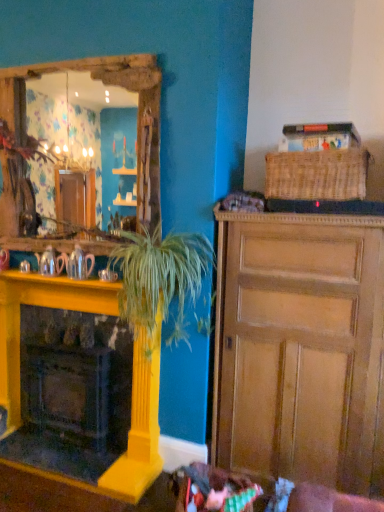
Question: Is wooden cabinet at right aimed at shiny silver teapot at left, the 2th teapot from the right?

Choices:
 (A) no
 (B) yes

Answer: (A)

Question: Is wooden cabinet at right at the right side of shiny silver teapot at left, the 2th teapot from the right?

Choices:
 (A) yes
 (B) no

Answer: (A)

Question: Can you confirm if wooden cabinet at right is wider than shiny silver teapot at left, the first teapot viewed from the left?

Choices:
 (A) no
 (B) yes

Answer: (B)

Question: Is wooden cabinet at right positioned in front of shiny silver teapot at left, the 2th teapot from the right?

Choices:
 (A) yes
 (B) no

Answer: (A)

Question: Is wooden cabinet at right outside of shiny silver teapot at left, the first teapot viewed from the left?

Choices:
 (A) yes
 (B) no

Answer: (A)

Question: Is green leafy plant at center taller or shorter than shiny silver teapot at left, the 2th teapot from the right?

Choices:
 (A) short
 (B) tall

Answer: (B)

Question: Looking at their shapes, would you say green leafy plant at center is wider or thinner than shiny silver teapot at left, the 2th teapot from the right?

Choices:
 (A) wide
 (B) thin

Answer: (A)

Question: Does point (172, 263) appear closer or farther from the camera than point (44, 266)?

Choices:
 (A) closer
 (B) farther

Answer: (A)

Question: Relative to shiny silver teapot at left, the 2th teapot from the right, is green leafy plant at center in front or behind?

Choices:
 (A) front
 (B) behind

Answer: (A)

Question: Is point (142, 433) positioned closer to the camera than point (334, 343)?

Choices:
 (A) farther
 (B) closer

Answer: (A)

Question: Is yellow painted wood fireplace at left in front of or behind wooden cabinet at right in the image?

Choices:
 (A) behind
 (B) front

Answer: (A)

Question: Considering the positions of yellow painted wood fireplace at left and wooden cabinet at right in the image, is yellow painted wood fireplace at left wider or thinner than wooden cabinet at right?

Choices:
 (A) thin
 (B) wide

Answer: (A)

Question: From a real-world perspective, is yellow painted wood fireplace at left positioned above or below wooden cabinet at right?

Choices:
 (A) above
 (B) below

Answer: (B)

Question: In terms of height, does woven brown picnic basket at upper right look taller or shorter compared to wooden cabinet at right?

Choices:
 (A) short
 (B) tall

Answer: (A)

Question: Would you say woven brown picnic basket at upper right is to the left or to the right of wooden cabinet at right in the picture?

Choices:
 (A) left
 (B) right

Answer: (B)